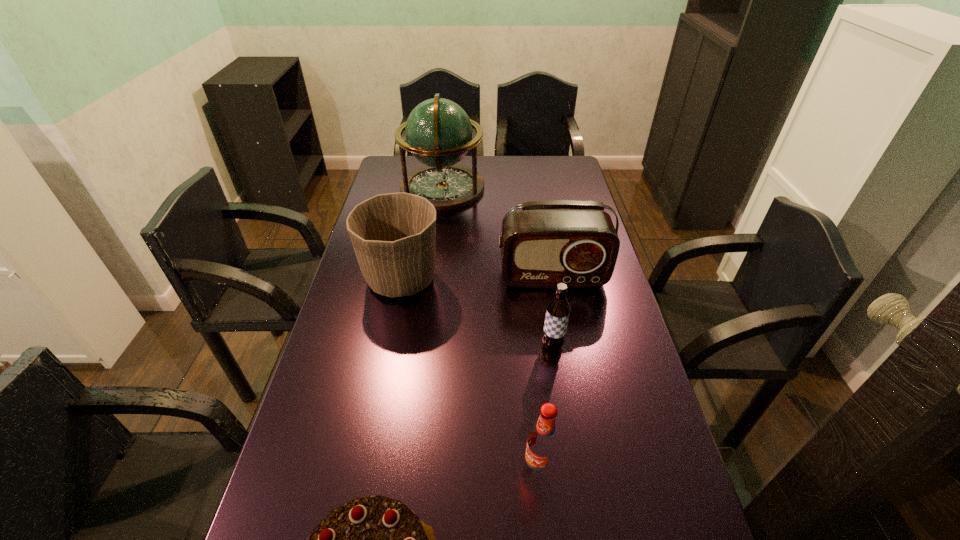
At what (x,y) coordinates should I click in order to perform the action: click on the tallest object. Please return your answer as a coordinate pair (x, y). Image resolution: width=960 pixels, height=540 pixels. Looking at the image, I should click on (438, 132).

Locate an element on the screen. the farthest object is located at coordinates (438, 132).

The width and height of the screenshot is (960, 540). Find the location of `radio receiver`. radio receiver is located at coordinates (548, 242).

Image resolution: width=960 pixels, height=540 pixels. What are the coordinates of `flowerpot` in the screenshot? It's located at (393, 235).

Locate an element on the screen. The image size is (960, 540). the nearer root beer is located at coordinates click(x=542, y=446).

Locate an element on the screen. The image size is (960, 540). the left root beer is located at coordinates (542, 446).

I want to click on the farther root beer, so click(558, 309).

I want to click on the fourth farthest object, so click(558, 309).

Find the location of a particular element. The width and height of the screenshot is (960, 540). free location located on the front-facing side of the tallest object is located at coordinates (564, 187).

Find the location of a particular element. This screenshot has height=540, width=960. free space located 0.220m on the front panel of the radio receiver is located at coordinates (565, 346).